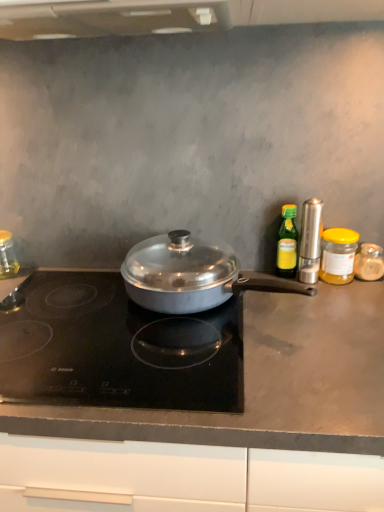
Question: Considering the positions of black glass cooktop at center and satin silver pepper mill at right, acting as the third kitchen appliance starting from the right, in the image, is black glass cooktop at center taller or shorter than satin silver pepper mill at right, acting as the third kitchen appliance starting from the right,?

Choices:
 (A) tall
 (B) short

Answer: (B)

Question: Is point (23, 373) positioned closer to the camera than point (301, 249)?

Choices:
 (A) farther
 (B) closer

Answer: (B)

Question: Considering the real-world distances, which object is closest to the satin silver pepper mill at right, the 4th kitchen appliance positioned from the left?

Choices:
 (A) clear glass jar at left, the sixth kitchen appliance in the right-to-left sequence
 (B) green glass bottle at right, which is the fourth kitchen appliance from right to left
 (C) matte gray countertop at center
 (D) satin silver pan at center, the 2th kitchen appliance from the left
 (E) translucent glass jar at right, which is counted as the 1th kitchen appliance, starting from the right

Answer: (B)

Question: Based on their relative distances, which object is nearer to the black glass cooktop at center?

Choices:
 (A) yellow glass jar at right, arranged as the fifth kitchen appliance when viewed from the left
 (B) clear glass jar at left, the first kitchen appliance in the left-to-right sequence
 (C) green glass bottle at right, acting as the third kitchen appliance starting from the left
 (D) satin silver pan at center, the 2th kitchen appliance from the left
 (E) satin silver pepper mill at right, the 4th kitchen appliance positioned from the left

Answer: (D)